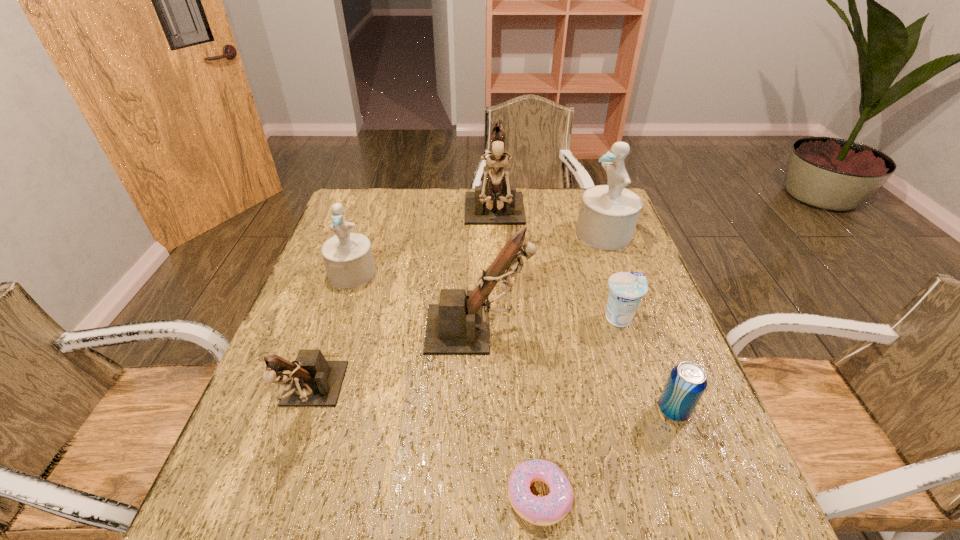
The image size is (960, 540). Identify the location of free space located 0.050m on the front-facing side of the leftmost brown figurine. (288, 464).

At what (x,y) coordinates should I click in order to perform the action: click on vacant space located on the left of the blue beer can. Please return your answer as a coordinate pair (x, y). The height and width of the screenshot is (540, 960). Looking at the image, I should click on (505, 410).

The height and width of the screenshot is (540, 960). What are the coordinates of `vacant region located on the front of the blue yogurt` in the screenshot? It's located at (679, 501).

Image resolution: width=960 pixels, height=540 pixels. I want to click on vacant space located 0.080m on the right of the pink doughnut, so click(x=617, y=496).

The width and height of the screenshot is (960, 540). What are the coordinates of `object that is at the near edge` in the screenshot? It's located at (548, 510).

At what (x,y) coordinates should I click in order to perform the action: click on figurine located at the right edge. Please return your answer as a coordinate pair (x, y). Looking at the image, I should click on (608, 214).

Locate an element on the screen. This screenshot has height=540, width=960. beer can positioned at the right edge is located at coordinates (687, 381).

This screenshot has height=540, width=960. Identify the location of yogurt situated at the right edge. (626, 290).

Where is `object situated at the far right corner`? The width and height of the screenshot is (960, 540). object situated at the far right corner is located at coordinates (608, 214).

In the image, there is a desktop. What are the coordinates of `free space at the far edge` in the screenshot? It's located at (412, 202).